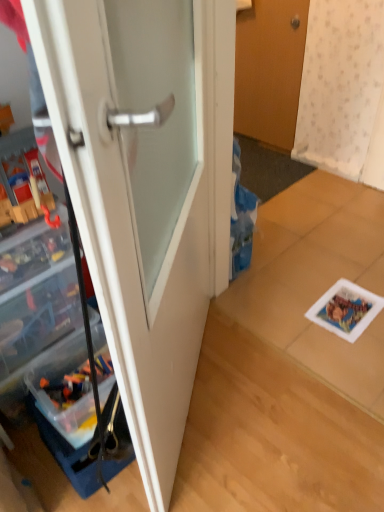
Where is `clear plastic cabinet at left`? This screenshot has width=384, height=512. clear plastic cabinet at left is located at coordinates (86, 322).

Locate an element on the screen. clear plastic cabinet at left is located at coordinates (x=86, y=322).

Which object is positioned more to the left, wooden door at upper center, marked as the 2th door in a left-to-right arrangement, or white glossy door at center, marked as the second door in a right-to-left arrangement?

white glossy door at center, marked as the second door in a right-to-left arrangement, is more to the left.

Is wooden door at upper center, positioned as the 1th door in back-to-front order, inside the boundaries of white glossy door at center, marked as the second door in a right-to-left arrangement, or outside?

wooden door at upper center, positioned as the 1th door in back-to-front order, is not inside white glossy door at center, marked as the second door in a right-to-left arrangement, it's outside.

Which is nearer, (278, 96) or (101, 254)?

Point (278, 96) is farther from the camera than point (101, 254).

How many degrees apart are the facing directions of white glossy door at center, the 2th door from the top, and clear plastic cabinet at left?

They differ by 180 degrees in their facing directions.

Based on the photo, is white glossy door at center, the first door when ordered from left to right, turned away from clear plastic cabinet at left?

Yes, white glossy door at center, the first door when ordered from left to right, is facing away from clear plastic cabinet at left.

Considering the positions of point (83, 136) and point (91, 447), is point (83, 136) closer or farther from the camera than point (91, 447)?

Clearly, point (83, 136) is closer to the camera than point (91, 447).

From the image's perspective, is white glossy door at center, the 1th door when ordered from bottom to top, positioned above or below clear plastic cabinet at left?

white glossy door at center, the 1th door when ordered from bottom to top, is situated higher than clear plastic cabinet at left in the image.

How different are the orientations of clear plastic cabinet at left and wooden door at upper center, which is the second door from front to back, in degrees?

clear plastic cabinet at left and wooden door at upper center, which is the second door from front to back, are facing 55.5 degrees away from each other.

Is clear plastic cabinet at left not close to wooden door at upper center, the 1th door when ordered from top to bottom?

Yes, clear plastic cabinet at left is far from wooden door at upper center, the 1th door when ordered from top to bottom.

Between clear plastic cabinet at left and wooden door at upper center, marked as the 2th door in a left-to-right arrangement, which one has larger width?

With larger width is wooden door at upper center, marked as the 2th door in a left-to-right arrangement.

Between clear plastic cabinet at left and wooden door at upper center, positioned as the 1th door in back-to-front order, which one appears on the left side from the viewer's perspective?

From the viewer's perspective, clear plastic cabinet at left appears more on the left side.

From a real-world perspective, which is physically below, white glossy door at center, the first door when ordered from left to right, or wooden door at upper center, positioned as the 1th door in back-to-front order?

In real-world perspective, wooden door at upper center, positioned as the 1th door in back-to-front order, is lower.

Is white glossy door at center, marked as the second door in a right-to-left arrangement, situated inside wooden door at upper center, the 1th door when ordered from top to bottom, or outside?

white glossy door at center, marked as the second door in a right-to-left arrangement, is not enclosed by wooden door at upper center, the 1th door when ordered from top to bottom.

Would you say white glossy door at center, marked as the second door in a right-to-left arrangement, is to the left or to the right of wooden door at upper center, the 1th door when ordered from top to bottom, in the picture?

white glossy door at center, marked as the second door in a right-to-left arrangement, is to the left of wooden door at upper center, the 1th door when ordered from top to bottom.

Is white glossy door at center, marked as the second door in a right-to-left arrangement, in front of or behind wooden door at upper center, the 1th door when ordered from top to bottom, in the image?

white glossy door at center, marked as the second door in a right-to-left arrangement, is positioned closer to the viewer than wooden door at upper center, the 1th door when ordered from top to bottom.

Does wooden door at upper center, marked as the 2th door in a left-to-right arrangement, have a lesser height compared to clear plastic cabinet at left?

No.

Which object is closer to the camera taking this photo, wooden door at upper center, positioned as the 1th door in back-to-front order, or clear plastic cabinet at left?

clear plastic cabinet at left.

Based on the photo, from a real-world perspective, is clear plastic cabinet at left positioned over white glossy door at center, placed as the 2th door when sorted from back to front, based on gravity?

Result: Yes.

Is point (126, 449) positioned in front of point (208, 186)?

Yes, it is in front of point (208, 186).

Can you confirm if clear plastic cabinet at left is positioned to the left of white glossy door at center, arranged as the 1th door when viewed from the front?

Yes, clear plastic cabinet at left is to the left of white glossy door at center, arranged as the 1th door when viewed from the front.

Is clear plastic cabinet at left situated inside white glossy door at center, arranged as the 1th door when viewed from the front, or outside?

clear plastic cabinet at left exists entirely within white glossy door at center, arranged as the 1th door when viewed from the front.

There is a wooden door at upper center, which is the second door from front to back. At what (x,y) coordinates should I click in order to perform the action: click on door above it (from a real-world perspective). Please return your answer as a coordinate pair (x, y). The height and width of the screenshot is (512, 384). Looking at the image, I should click on (146, 190).

From a real-world perspective, starting from the clear plastic cabinet at left, which door is the 1st one below it? Please provide its 2D coordinates.

[(146, 190)]

Looking at the image, which one is located closer to white glossy door at center, marked as the second door in a right-to-left arrangement, clear plastic cabinet at left or wooden door at upper center, positioned as the 1th door in back-to-front order?

clear plastic cabinet at left is positioned closer to the anchor white glossy door at center, marked as the second door in a right-to-left arrangement.

From the image, which object appears to be farther from white glossy door at center, placed as the 2th door when sorted from back to front, wooden door at upper center, which is counted as the 1th door, starting from the right, or clear plastic cabinet at left?

wooden door at upper center, which is counted as the 1th door, starting from the right.

From the image, which object appears to be nearer to clear plastic cabinet at left, white glossy door at center, the 2th door from the top, or wooden door at upper center, marked as the 2th door in a left-to-right arrangement?

white glossy door at center, the 2th door from the top, is closer to clear plastic cabinet at left.

When comparing their distances from clear plastic cabinet at left, does wooden door at upper center, the 1th door when ordered from top to bottom, or white glossy door at center, the first door when ordered from left to right, seem closer?

Based on the image, white glossy door at center, the first door when ordered from left to right, appears to be nearer to clear plastic cabinet at left.

Looking at the image, which one is located further to wooden door at upper center, positioned as the 1th door in back-to-front order, clear plastic cabinet at left or white glossy door at center, arranged as the 1th door when viewed from the front?

The object further to wooden door at upper center, positioned as the 1th door in back-to-front order, is clear plastic cabinet at left.

Looking at this image, based on their spatial positions, is white glossy door at center, the first door when ordered from left to right, or clear plastic cabinet at left closer to wooden door at upper center, positioned as the 1th door in back-to-front order?

Among the two, white glossy door at center, the first door when ordered from left to right, is located nearer to wooden door at upper center, positioned as the 1th door in back-to-front order.

Locate an element on the screen. The width and height of the screenshot is (384, 512). cabinetry between white glossy door at center, the first door when ordered from left to right, and wooden door at upper center, the 1th door when ordered from top to bottom, in the front-back direction is located at coordinates (86, 322).